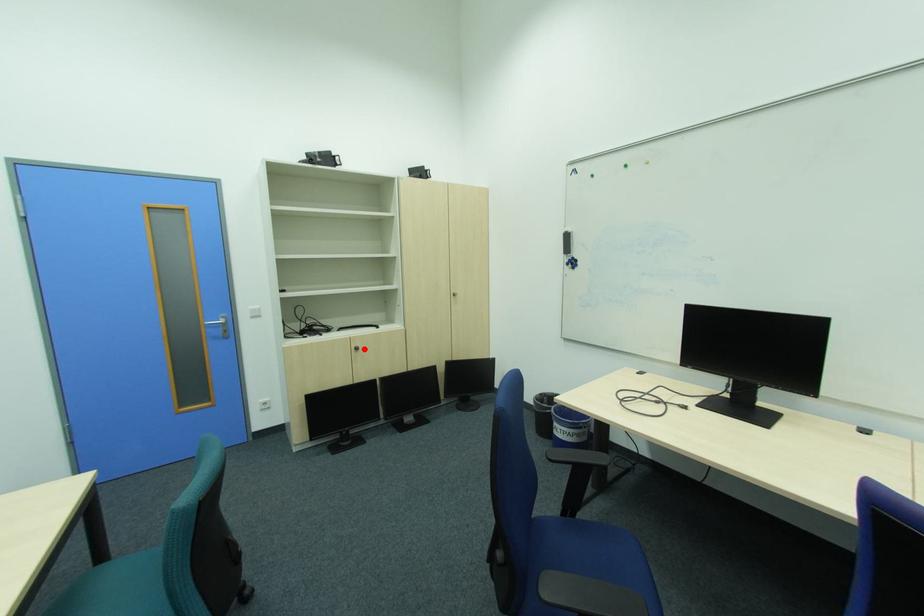
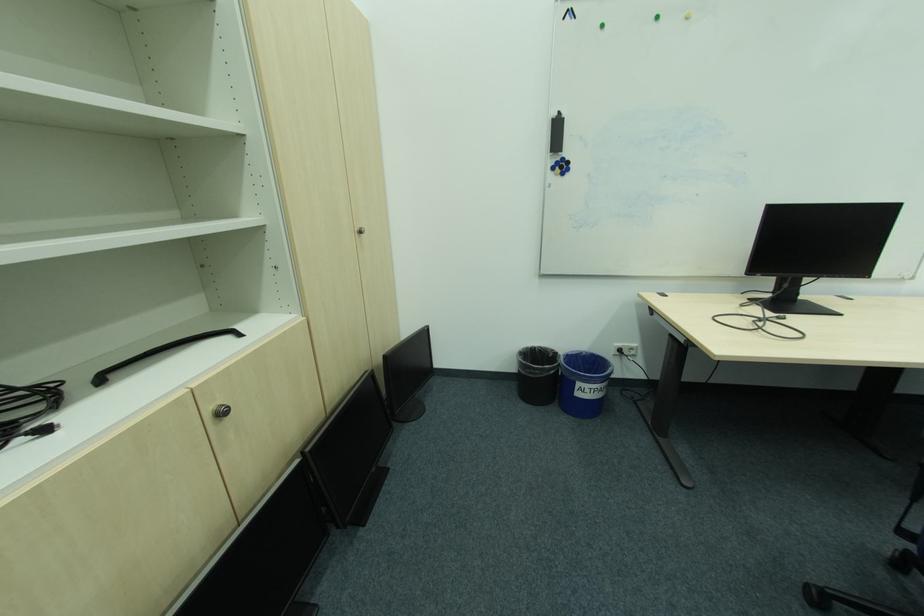
Question: I am providing you with two images of the same scene from different viewpoints. In image1, a red point is highlighted. Considering the same 3D point in image2, which of the following is correct?

Choices:
 (A) It is closer
 (B) It is farther

Answer: (A)